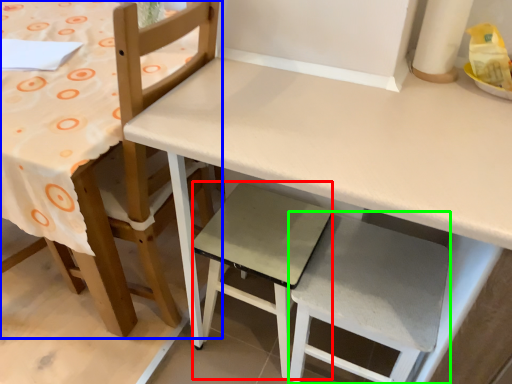
Question: Based on their relative distances, which object is farther from step stool (highlighted by a red box)? Choose from chair (highlighted by a blue box) and step stool (highlighted by a green box).

Choices:
 (A) chair
 (B) step stool

Answer: (A)